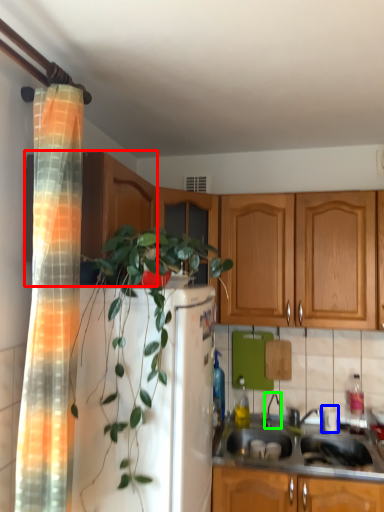
Question: Estimate the real-world distances between objects in this image. Which object is closer to cabinetry (highlighted by a red box), appliance (highlighted by a blue box) or faucet (highlighted by a green box)?

Choices:
 (A) appliance
 (B) faucet

Answer: (B)